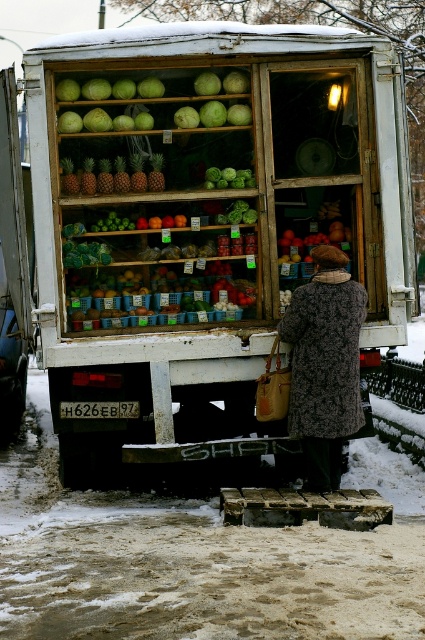
From the picture: You are a customer standing in front of the white matte food truck at center and the shiny red apples at center. Which object is located to the right side of the other?

The shiny red apples at center are positioned to the right of the white matte food truck at center.

You are a customer at the mobile fruit and vegetable stall. You see the fluffy brown coat at center and the pineapple matte at center. Which item is bigger in size?

The fluffy brown coat at center is larger in size than the pineapple matte at center.